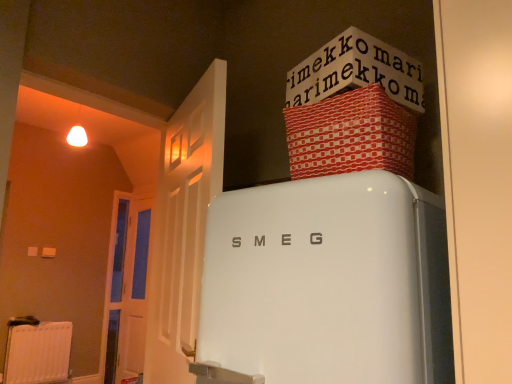
Question: Considering the relative sizes of white plastic radiator at lower left and white wooden door at left, the first door from the front, in the image provided, is white plastic radiator at lower left wider than white wooden door at left, the first door from the front,?

Choices:
 (A) yes
 (B) no

Answer: (B)

Question: Considering the relative positions of white plastic radiator at lower left and white wooden door at left, arranged as the first door when viewed from the right, in the image provided, is white plastic radiator at lower left to the left of white wooden door at left, arranged as the first door when viewed from the right, from the viewer's perspective?

Choices:
 (A) yes
 (B) no

Answer: (A)

Question: Is white plastic radiator at lower left touching white wooden door at left, which is counted as the 2th door, starting from the left?

Choices:
 (A) yes
 (B) no

Answer: (B)

Question: Is white plastic radiator at lower left facing towards white wooden door at left, which ranks as the 2th door in back-to-front order?

Choices:
 (A) no
 (B) yes

Answer: (B)

Question: Is white plastic radiator at lower left located outside white wooden door at left, the first door from the front?

Choices:
 (A) yes
 (B) no

Answer: (A)

Question: Looking at the image, does white wooden door at left, positioned as the second door in right-to-left order, seem bigger or smaller compared to white plastic radiator at lower left?

Choices:
 (A) big
 (B) small

Answer: (A)

Question: Looking at their shapes, would you say white wooden door at left, which ranks as the first door in left-to-right order, is wider or thinner than white plastic radiator at lower left?

Choices:
 (A) wide
 (B) thin

Answer: (A)

Question: From a real-world perspective, relative to white plastic radiator at lower left, is white wooden door at left, which ranks as the first door in left-to-right order, vertically above or below?

Choices:
 (A) above
 (B) below

Answer: (A)

Question: From the image's perspective, relative to white plastic radiator at lower left, is white wooden door at left, which ranks as the first door in left-to-right order, above or below?

Choices:
 (A) below
 (B) above

Answer: (B)

Question: Visually, is white wooden door at left, arranged as the 2th door when viewed from the front, positioned to the left or to the right of white wooden door at left, the first door from the front?

Choices:
 (A) right
 (B) left

Answer: (B)

Question: In terms of height, does white wooden door at left, arranged as the 2th door when viewed from the front, look taller or shorter compared to white wooden door at left, arranged as the first door when viewed from the right?

Choices:
 (A) tall
 (B) short

Answer: (A)

Question: From a real-world perspective, is white wooden door at left, arranged as the 2th door when viewed from the front, above or below white wooden door at left, which ranks as the 2th door in back-to-front order?

Choices:
 (A) below
 (B) above

Answer: (A)

Question: Looking at the image, does white wooden door at left, which ranks as the first door in left-to-right order, seem bigger or smaller compared to white wooden door at left, which is counted as the 2th door, starting from the left?

Choices:
 (A) small
 (B) big

Answer: (A)

Question: From the image's perspective, is white paper at upper center above or below red textured fabric box at upper right?

Choices:
 (A) above
 (B) below

Answer: (A)

Question: Is white paper at upper center spatially inside red textured fabric box at upper right, or outside of it?

Choices:
 (A) inside
 (B) outside

Answer: (B)